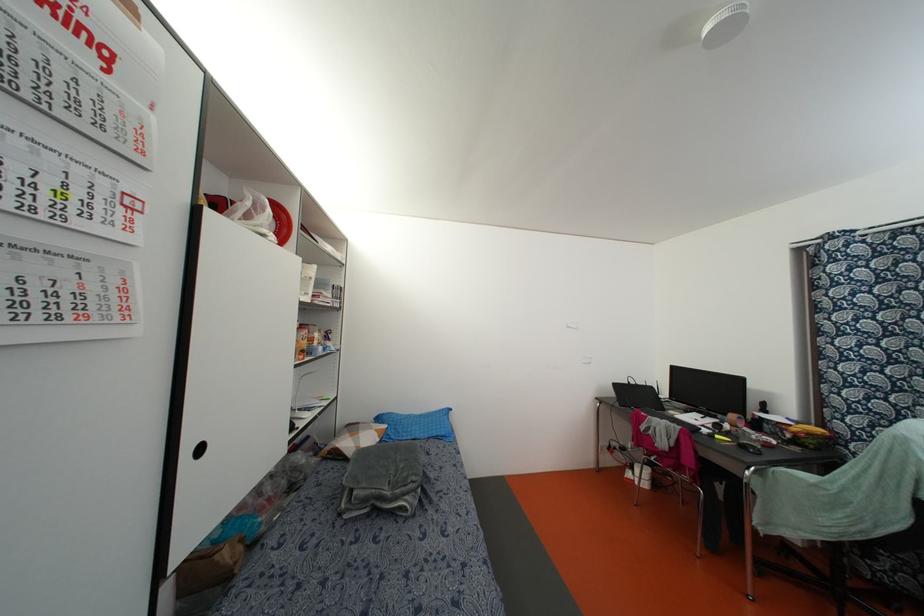
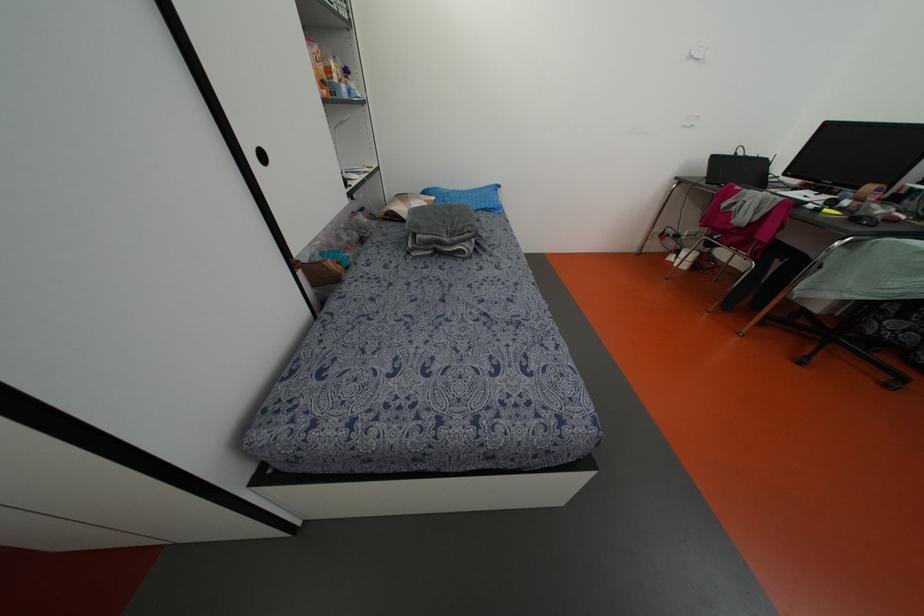
Locate, in the second image, the point that corresponds to (x=442, y=434) in the first image.

(492, 206)